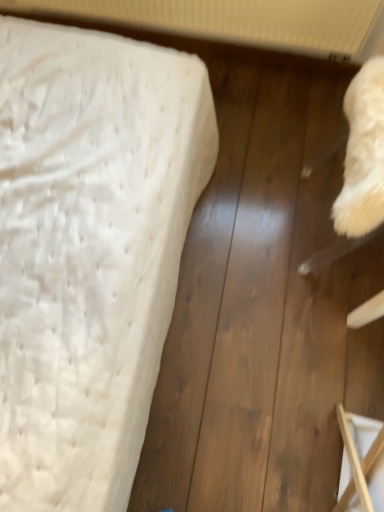
The width and height of the screenshot is (384, 512). What are the coordinates of `vacant space positioned to the left of wooden frame at lower right` in the screenshot? It's located at (284, 445).